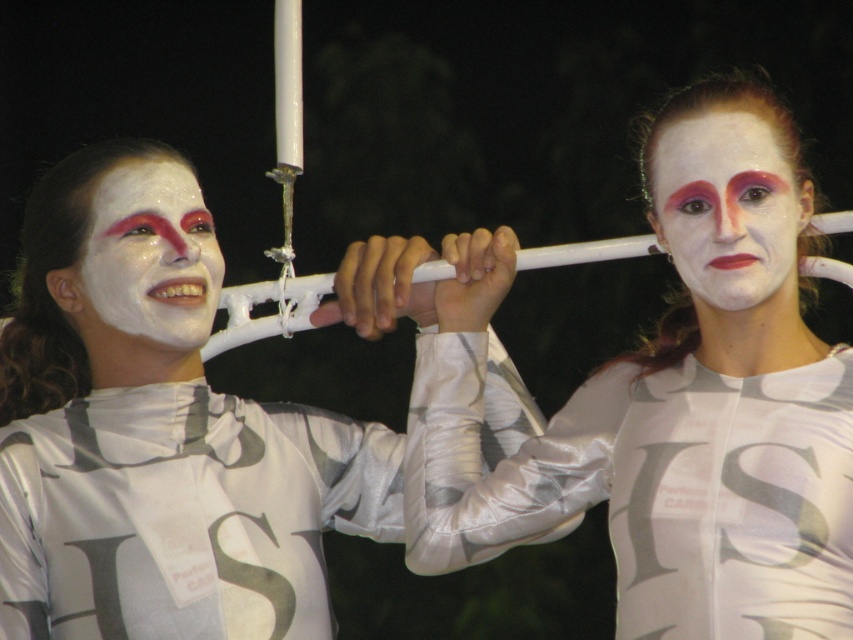
Which of these two, white satin costume at upper center or white matte face at left, stands taller?

white satin costume at upper center is taller.

Between point (534, 413) and point (204, 260), which one is positioned in front?

Point (204, 260) is more forward.

What do you see at coordinates (158, 432) in the screenshot?
I see `white satin costume at upper center` at bounding box center [158, 432].

Locate an element on the screen. The image size is (853, 640). white satin costume at upper center is located at coordinates (158, 432).

Between white satin costume at upper center and white matte face at upper right, which one has less height?

white matte face at upper right is shorter.

Between white satin costume at upper center and white matte face at upper right, which one is positioned higher?

white matte face at upper right

Who is more distant from viewer, (134, 540) or (704, 140)?

Point (134, 540)

Locate an element on the screen. This screenshot has width=853, height=640. white satin costume at upper center is located at coordinates (158, 432).

The image size is (853, 640). Identify the location of white satin/velvet mask at center. (668, 404).

Image resolution: width=853 pixels, height=640 pixels. What are the coordinates of `white satin/velvet mask at center` in the screenshot? It's located at (668, 404).